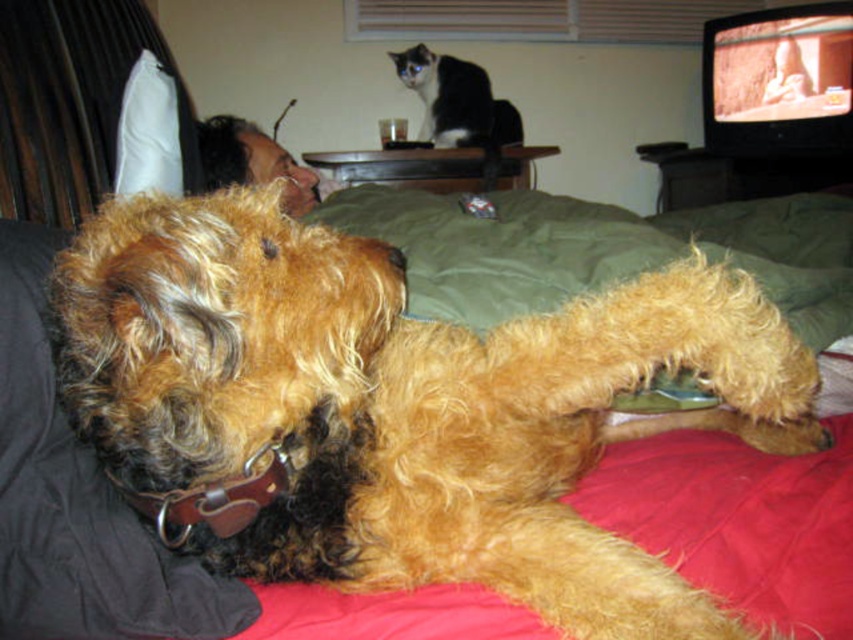
Question: Is fuzzy brown dog at center to the right of black and white fur at upper center from the viewer's perspective?

Choices:
 (A) yes
 (B) no

Answer: (A)

Question: Does black and white fur at upper center appear over white fabric pillow at upper left?

Choices:
 (A) no
 (B) yes

Answer: (B)

Question: Which point is farther to the camera?

Choices:
 (A) (428, 58)
 (B) (491, 445)

Answer: (A)

Question: Which is farther from the black and white fur at upper center?

Choices:
 (A) white fabric pillow at upper left
 (B) fuzzy brown dog at center

Answer: (B)

Question: Which object is the closest to the white fabric pillow at upper left?

Choices:
 (A) fuzzy brown dog at center
 (B) black and white fur at upper center

Answer: (A)

Question: Can you confirm if fuzzy brown dog at center is bigger than black and white fur at upper center?

Choices:
 (A) yes
 (B) no

Answer: (A)